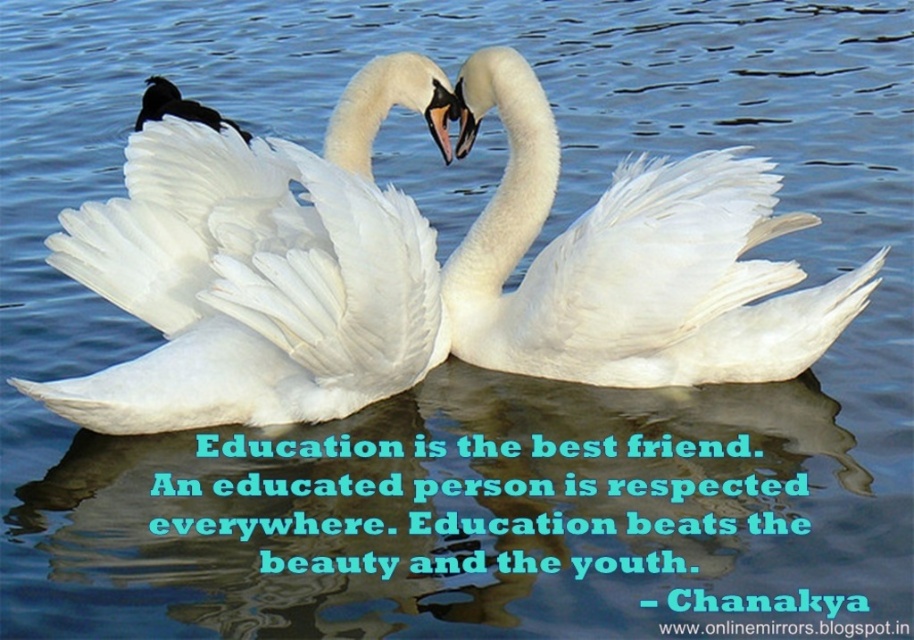
You are a photographer trying to capture the heart shape formed by the two swans. You want to ensure both the white feathered swan at center and the white glossy swan at upper left are clearly visible in your photo. Which swan should you focus on to make sure the one in front is sharp?

You should focus on the white feathered swan at center because the white glossy swan at upper left is behind it, so focusing on the front swan will keep both in focus if they are in the same focal plane.

You are a photographer aiming to capture a closeup shot of the white feathered swan at center. Given that your camera has a minimum focusing distance of 20 feet, will you be able to take the photo without moving closer?

The distance between the white feathered swan at center and the camera is 20.32 feet, which is slightly beyond the camera minimum focusing distance of 20 feet. Therefore, you will not be able to capture a closeup shot without moving closer.

What is the position of the white feathered swan at center relative to the black feathered duck at upper left?

The white feathered swan at center is to the right of the black feathered duck at upper left.